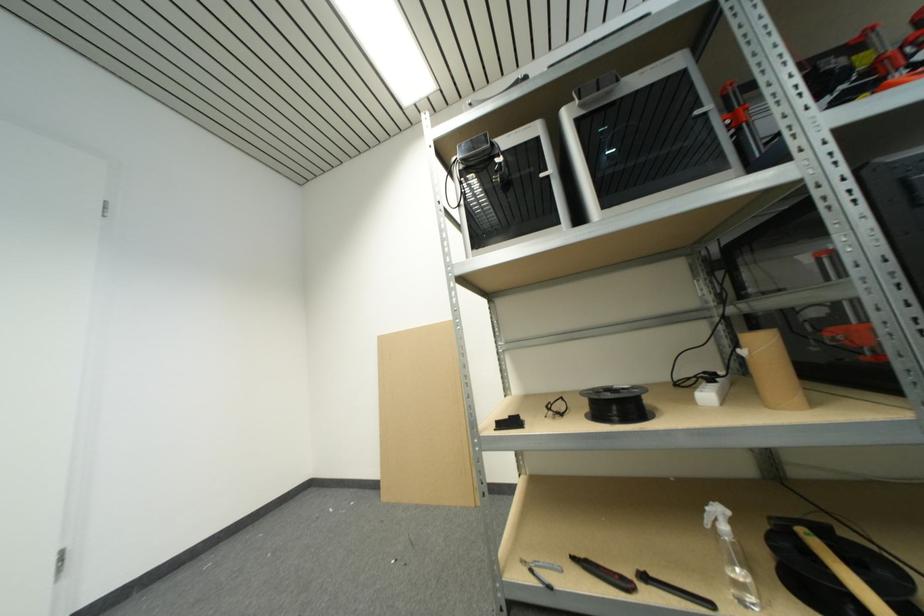
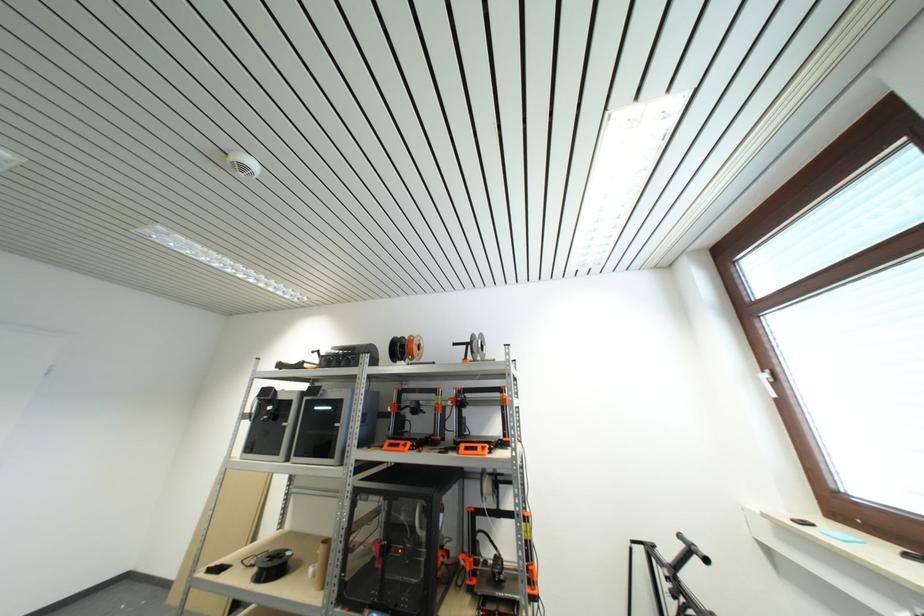
In the second image, find the point that corresponds to point 563,225 in the first image.

(283, 456)